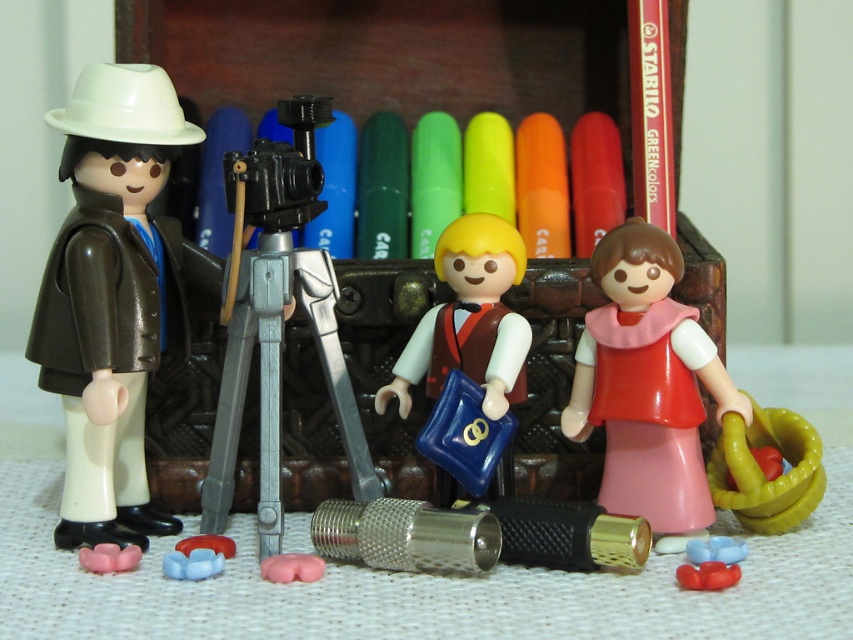
You are a toy collector examining the scene. You notice the matte brown jacket at left and the smooth brown vest at center. Which object is positioned higher in the image?

The matte brown jacket at left is positioned higher than the smooth brown vest at center.

In the scene shown: You are a toy collector organizing a display. You need to arrange the pink matte dress at center and the pink rubber flower at lower left on a shelf. Which object should be placed higher on the shelf to ensure stability?

The pink matte dress at center should be placed higher on the shelf since it is taller than the pink rubber flower at lower left, ensuring stability by positioning the taller item where it can be better supported.